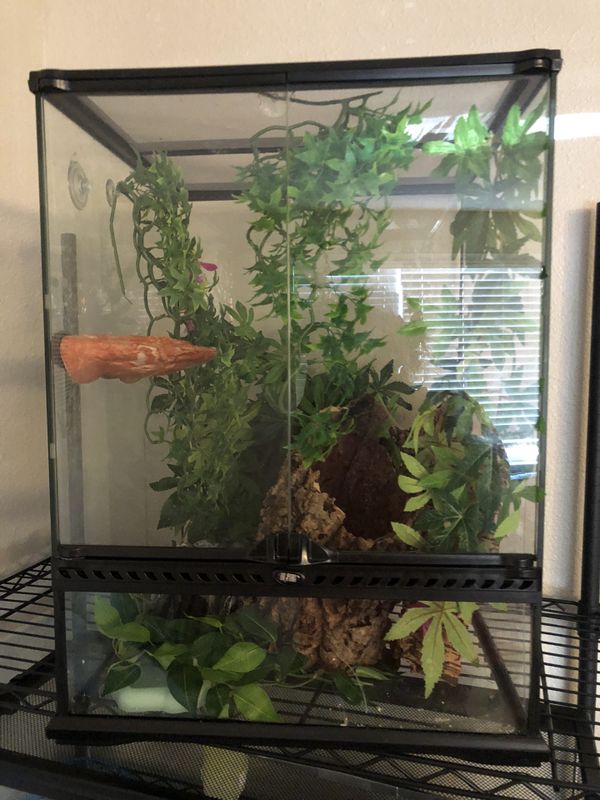
I want to click on plant, so click(x=431, y=485), click(x=433, y=620), click(x=222, y=494), click(x=336, y=380), click(x=175, y=642), click(x=177, y=290), click(x=333, y=174), click(x=489, y=180).